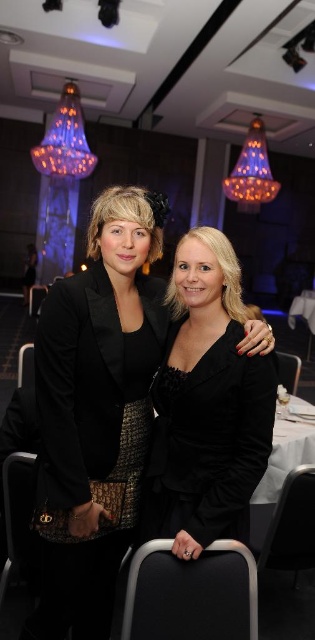
You are a photographer at a formal event. You have a camera with a lens that can focus on objects within a 10 inch range. You need to capture a photo of both the black velvet dress at center and the black velvet jacket at center. Can your camera focus on both items simultaneously?

The distance between the black velvet dress at center and the black velvet jacket at center is 9.79 inches, which is within the 10 inch range of the camera lens. Therefore, the camera can focus on both items simultaneously.

You are a photographer at the event and need to decide which garment to focus on for a closeup shot. Since the black velvet dress at center is larger than the black textured blazer at center, which one would you choose to ensure the entire garment fits within your camera frame?

The black velvet dress at center is bigger than the black textured blazer at center, so you should focus on the black velvet dress at center to ensure it fits within the camera frame.